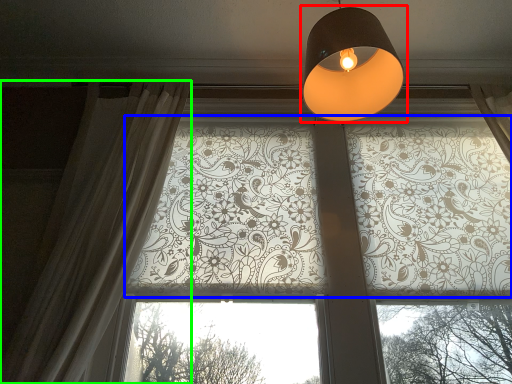
Question: Considering the real-world distances, which object is farthest from lamp (highlighted by a red box)? bay window (highlighted by a blue box) or curtain (highlighted by a green box)?

Choices:
 (A) bay window
 (B) curtain

Answer: (B)